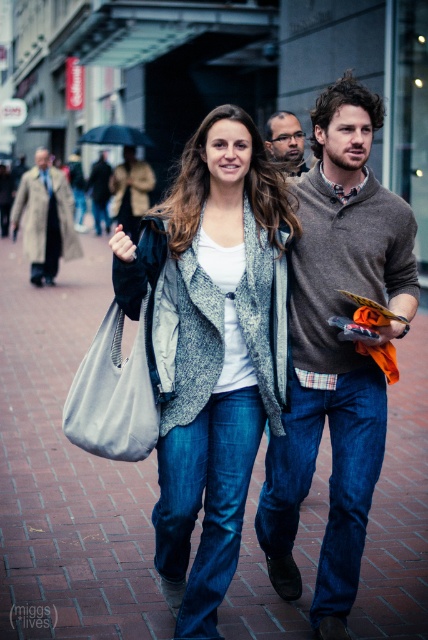
You are a fashion designer observing the urban street scene. You need to determine which item is larger between the knitted gray cardigan at center and the canvas tote bag at center. Which one is bigger?

The knitted gray cardigan at center is bigger than the canvas tote bag at center according to the description.

You are a photographer trying to capture both the matte gray coat at center and the matte brown sweater at center in the same frame. Based on their heights, which one should you focus on to ensure both are fully visible in the photo?

The matte gray coat at center is much taller than the matte brown sweater at center, so focusing on the matte gray coat at center will ensure both are fully visible in the photo.